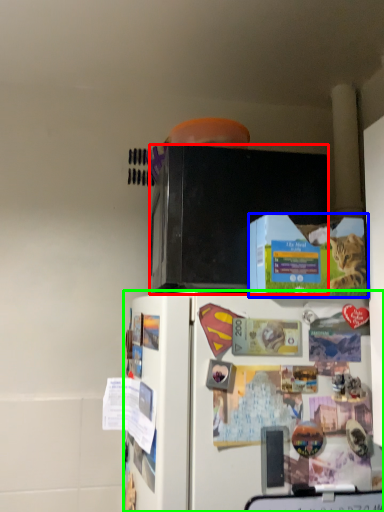
Question: Based on their relative distances, which object is nearer to microwave oven (highlighted by a red box)? Choose from box (highlighted by a blue box) and refrigerator (highlighted by a green box).

Choices:
 (A) box
 (B) refrigerator

Answer: (A)